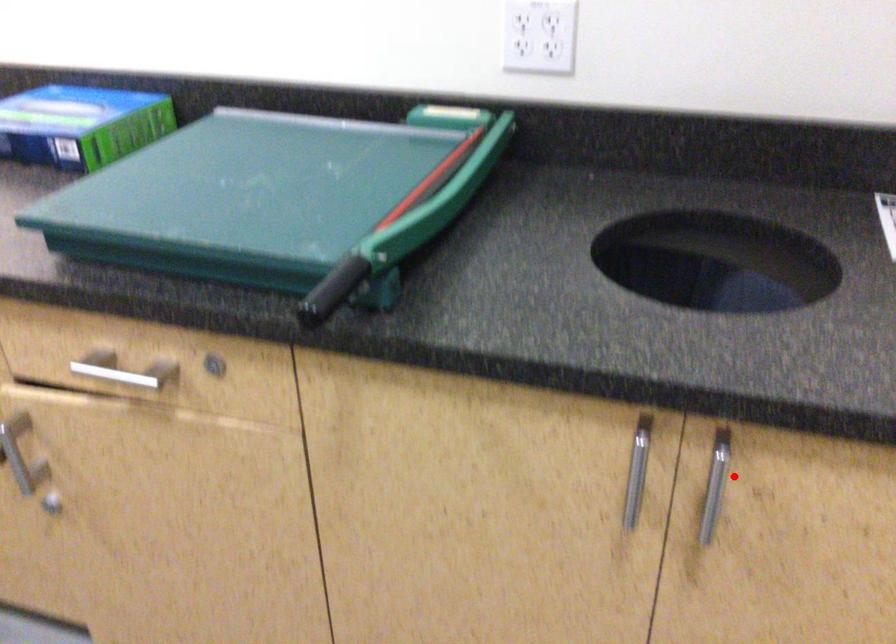
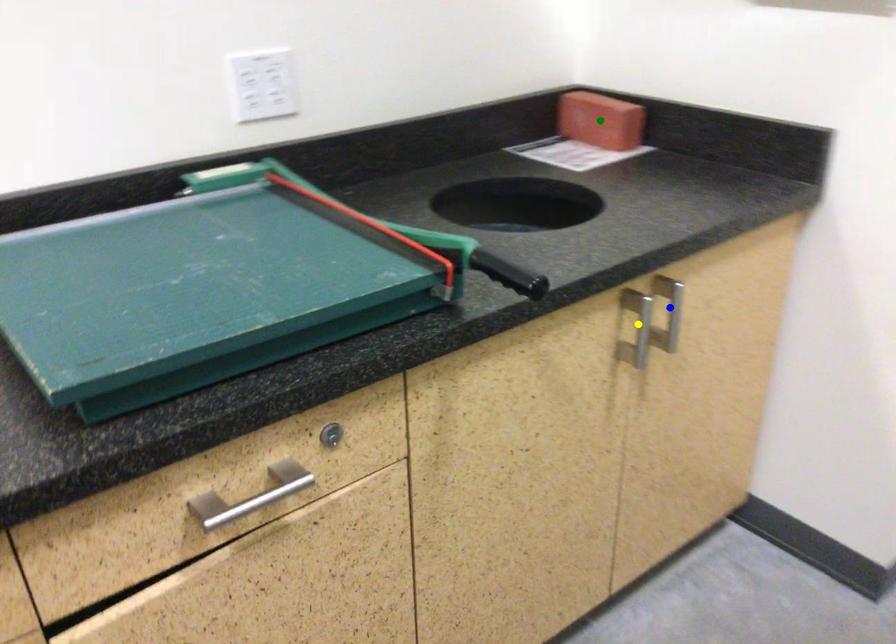
Question: I am providing you with two images of the same scene from different viewpoints. A red point is marked on the first image. You are given multiple points on the second image. Which point in image 2 represents the same 3d spot as the red point in image 1?

Choices:
 (A) yellow point
 (B) blue point
 (C) green point

Answer: (B)